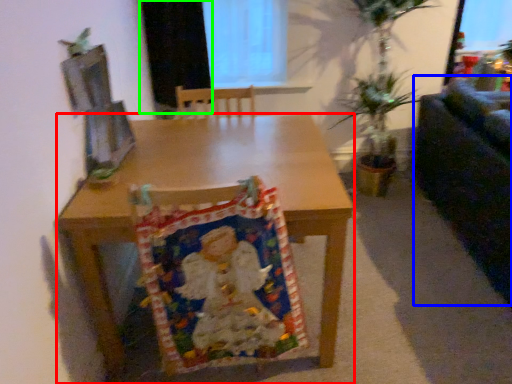
Question: Estimate the real-world distances between objects in this image. Which object is farther from desk (highlighted by a red box), couch (highlighted by a blue box) or curtain (highlighted by a green box)?

Choices:
 (A) couch
 (B) curtain

Answer: (A)